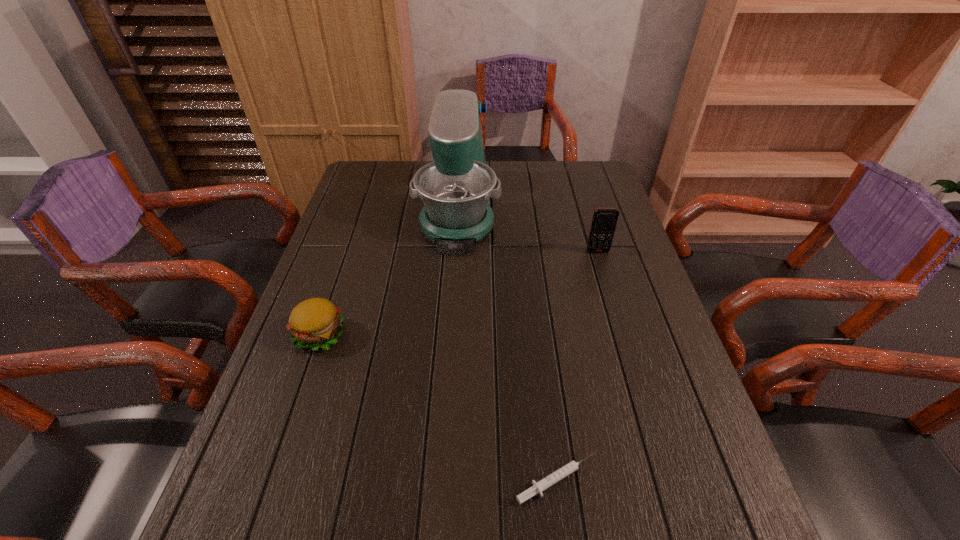
What are the coordinates of `vacant space located on the back of the shortest object` in the screenshot? It's located at (537, 320).

At what (x,y) coordinates should I click in order to perform the action: click on object situated at the far edge. Please return your answer as a coordinate pair (x, y). Looking at the image, I should click on (456, 187).

What are the coordinates of `object at the left edge` in the screenshot? It's located at (316, 322).

Identify the location of object situated at the right edge. (604, 221).

Locate an element on the screen. This screenshot has width=960, height=540. vacant space at the far edge of the desktop is located at coordinates (535, 165).

In order to click on free space at the left edge in this screenshot , I will do `click(350, 205)`.

This screenshot has width=960, height=540. In order to click on vacant region at the right edge of the desktop in this screenshot , I will do `click(665, 400)`.

This screenshot has height=540, width=960. Find the location of `blank area at the far right corner`. blank area at the far right corner is located at coordinates (602, 173).

Where is `vacant region between the cellular telephone and the leftmost object`? vacant region between the cellular telephone and the leftmost object is located at coordinates click(x=459, y=293).

Image resolution: width=960 pixels, height=540 pixels. I want to click on free space between the third tallest object and the mixer, so click(x=389, y=271).